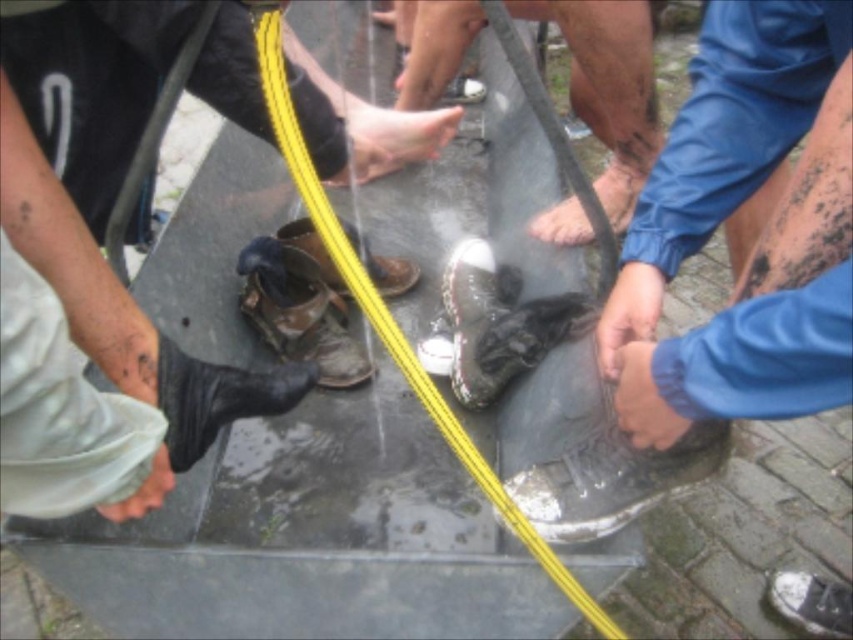
Which is below, black rubber boot at lower left or shiny metallic shoe at center?

Positioned lower is black rubber boot at lower left.

Which is above, black rubber boot at lower left or shiny metallic shoe at center?

Positioned higher is shiny metallic shoe at center.

Does point (173, 356) come closer to viewer compared to point (480, 84)?

Yes, it is in front of point (480, 84).

Where is `black rubber boot at lower left`? The height and width of the screenshot is (640, 853). black rubber boot at lower left is located at coordinates (218, 397).

Between shiny metallic boot at center and brown leather shoe at center, which one has less height?

brown leather shoe at center is shorter.

Is shiny metallic boot at center above brown leather shoe at center?

Incorrect, shiny metallic boot at center is not positioned above brown leather shoe at center.

Where is `shiny metallic boot at center`? This screenshot has width=853, height=640. shiny metallic boot at center is located at coordinates (467, 301).

Based on the photo, between shiny metallic boot at center and camouflage fabric boot at lower left, which one appears on the right side from the viewer's perspective?

From the viewer's perspective, shiny metallic boot at center appears more on the right side.

In the scene shown: Is shiny metallic boot at center bigger than camouflage fabric boot at lower left?

Indeed, shiny metallic boot at center has a larger size compared to camouflage fabric boot at lower left.

Is point (497, 273) closer to viewer compared to point (267, 326)?

No, (497, 273) is further to viewer.

This screenshot has height=640, width=853. I want to click on shiny metallic boot at center, so (467, 301).